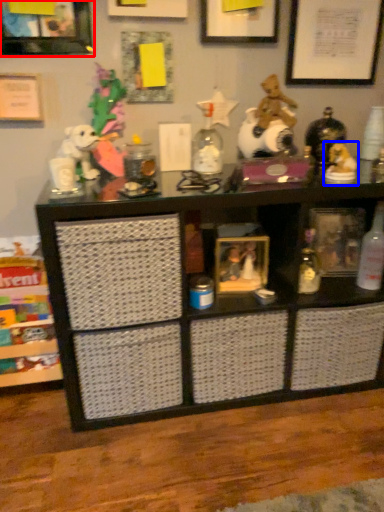
Question: Which object is further to the camera taking this photo, picture frame (highlighted by a red box) or toy (highlighted by a blue box)?

Choices:
 (A) picture frame
 (B) toy

Answer: (B)